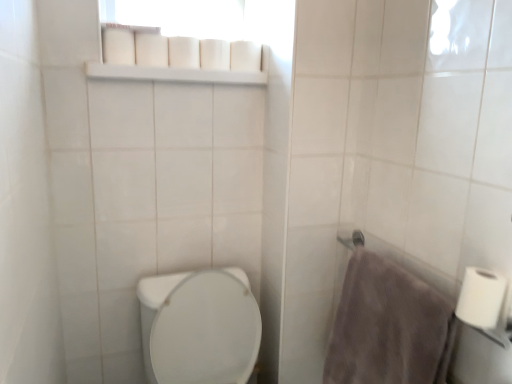
In order to face white matte toilet paper at right, positioned as the 3th toilet paper in top-to-bottom order, should I rotate leftwards or rightwards?

You should rotate right by 27.552 degrees.

Locate an element on the screen. Image resolution: width=512 pixels, height=384 pixels. gray fluffy towel at right is located at coordinates (389, 326).

What do you see at coordinates (389, 326) in the screenshot? This screenshot has height=384, width=512. I see `gray fluffy towel at right` at bounding box center [389, 326].

Measure the distance between white glossy toilet at lower left and camera.

white glossy toilet at lower left and camera are 1.34 meters apart.

The width and height of the screenshot is (512, 384). Find the location of `white matte toilet paper at right, which is the 1th toilet paper in right-to-left order`. white matte toilet paper at right, which is the 1th toilet paper in right-to-left order is located at coordinates (481, 298).

Does point (113, 60) come farther from viewer compared to point (219, 327)?

No, it is in front of (219, 327).

From the image's perspective, is white matte toilet paper at upper center, the 3th toilet paper when ordered from right to left, located above or below white glossy toilet at lower left?

white matte toilet paper at upper center, the 3th toilet paper when ordered from right to left, is above white glossy toilet at lower left.

Consider the image. What's the angular difference between white matte toilet paper at upper center, acting as the second toilet paper starting from the back, and white glossy toilet at lower left's facing directions?

The angle between the facing direction of white matte toilet paper at upper center, acting as the second toilet paper starting from the back, and the facing direction of white glossy toilet at lower left is 0.607 degrees.

Is the surface of white matte toilet paper at upper center, acting as the second toilet paper starting from the back, in direct contact with white glossy toilet at lower left?

No.

In terms of width, does white matte toilet paper at upper center, which appears as the 2th toilet paper when viewed from the right, look wider or thinner when compared to gray fluffy towel at right?

white matte toilet paper at upper center, which appears as the 2th toilet paper when viewed from the right, is thinner than gray fluffy towel at right.

Is gray fluffy towel at right at the back of white matte toilet paper at upper center, the 3th toilet paper when ordered from bottom to top?

Result: white matte toilet paper at upper center, the 3th toilet paper when ordered from bottom to top, is not turned away from gray fluffy towel at right.

What's the angular difference between white matte toilet paper at upper center, which ranks as the first toilet paper in back-to-front order, and gray fluffy towel at right's facing directions?

The facing directions of white matte toilet paper at upper center, which ranks as the first toilet paper in back-to-front order, and gray fluffy towel at right are 88.9 degrees apart.

Considering the positions of objects white matte toilet paper at upper center, which appears as the 2th toilet paper when viewed from the right, and gray fluffy towel at right in the image provided, who is more to the left, white matte toilet paper at upper center, which appears as the 2th toilet paper when viewed from the right, or gray fluffy towel at right?

white matte toilet paper at upper center, which appears as the 2th toilet paper when viewed from the right.

Is gray fluffy towel at right smaller than white matte toilet paper at upper center, acting as the first toilet paper starting from the top?

Actually, gray fluffy towel at right might be larger than white matte toilet paper at upper center, acting as the first toilet paper starting from the top.

How much distance is there between gray fluffy towel at right and white matte toilet paper at upper center, the 3th toilet paper when ordered from bottom to top?

A distance of 35.90 inches exists between gray fluffy towel at right and white matte toilet paper at upper center, the 3th toilet paper when ordered from bottom to top.

Based on the photo, which object is wider, gray fluffy towel at right or white matte toilet paper at upper center, the 3th toilet paper when ordered from bottom to top?

Wider between the two is gray fluffy towel at right.

Is gray fluffy towel at right outside of white matte toilet paper at upper center, acting as the first toilet paper starting from the top?

gray fluffy towel at right is positioned outside white matte toilet paper at upper center, acting as the first toilet paper starting from the top.

Which object is positioned more to the left, white plastic shelf at upper center or white matte toilet paper at upper center, the 2th toilet paper in the top-to-bottom sequence?

white matte toilet paper at upper center, the 2th toilet paper in the top-to-bottom sequence.

Would you say white matte toilet paper at upper center, which is counted as the 2th toilet paper, starting from the bottom, is part of white plastic shelf at upper center's contents?

Definitely not — white matte toilet paper at upper center, which is counted as the 2th toilet paper, starting from the bottom, is not inside white plastic shelf at upper center.

Can you confirm if white plastic shelf at upper center is taller than white matte toilet paper at upper center, which is counted as the 2th toilet paper, starting from the bottom?

In fact, white plastic shelf at upper center may be shorter than white matte toilet paper at upper center, which is counted as the 2th toilet paper, starting from the bottom.

The height and width of the screenshot is (384, 512). Identify the location of the 1st toilet paper above when counting from the white plastic shelf at upper center (from the image's perspective). (118, 46).

Measure the distance between gray fluffy towel at right and white glossy toilet at lower left.

The distance of gray fluffy towel at right from white glossy toilet at lower left is 17.77 inches.

Which object is thinner, gray fluffy towel at right or white glossy toilet at lower left?

gray fluffy towel at right is thinner.

Considering the sizes of gray fluffy towel at right and white glossy toilet at lower left in the image, is gray fluffy towel at right bigger or smaller than white glossy toilet at lower left?

Clearly, gray fluffy towel at right is smaller in size than white glossy toilet at lower left.

Locate an element on the screen. The height and width of the screenshot is (384, 512). toilet located in front of the gray fluffy towel at right is located at coordinates (199, 327).

Considering the sizes of objects white matte toilet paper at right, which is the 1th toilet paper in right-to-left order, and white matte toilet paper at upper center, which is counted as the 2th toilet paper, starting from the bottom, in the image provided, who is thinner, white matte toilet paper at right, which is the 1th toilet paper in right-to-left order, or white matte toilet paper at upper center, which is counted as the 2th toilet paper, starting from the bottom,?

Thinner between the two is white matte toilet paper at upper center, which is counted as the 2th toilet paper, starting from the bottom.

Who is taller, white matte toilet paper at right, which is the 1th toilet paper in right-to-left order, or white matte toilet paper at upper center, positioned as the first toilet paper in left-to-right order?

With more height is white matte toilet paper at right, which is the 1th toilet paper in right-to-left order.

This screenshot has width=512, height=384. Find the location of `the 1st toilet paper behind when counting from the white matte toilet paper at right, positioned as the 3th toilet paper in top-to-bottom order`. the 1st toilet paper behind when counting from the white matte toilet paper at right, positioned as the 3th toilet paper in top-to-bottom order is located at coordinates (118, 46).

Is the surface of white matte toilet paper at right, which is the 1th toilet paper in right-to-left order, in direct contact with white matte toilet paper at upper center, positioned as the first toilet paper in left-to-right order?

No, white matte toilet paper at right, which is the 1th toilet paper in right-to-left order, is not making contact with white matte toilet paper at upper center, positioned as the first toilet paper in left-to-right order.

Between white matte toilet paper at upper center, the 3th toilet paper when ordered from right to left, and white plastic shelf at upper center, which one appears on the left side from the viewer's perspective?

Positioned to the left is white matte toilet paper at upper center, the 3th toilet paper when ordered from right to left.

In the scene shown: Is white matte toilet paper at upper center, the 3th toilet paper when ordered from right to left, aimed at white plastic shelf at upper center?

No, white matte toilet paper at upper center, the 3th toilet paper when ordered from right to left, is not turned towards white plastic shelf at upper center.

From the image's perspective, is white matte toilet paper at upper center, marked as the second toilet paper in a front-to-back arrangement, on top of white plastic shelf at upper center?

Indeed, from the image's perspective, white matte toilet paper at upper center, marked as the second toilet paper in a front-to-back arrangement, is shown above white plastic shelf at upper center.

Locate an element on the screen. This screenshot has width=512, height=384. toilet on the right of white matte toilet paper at upper center, acting as the second toilet paper starting from the back is located at coordinates coord(199,327).

Find the location of `toilet paper that is the 1st object to the left of the gray fluffy towel at right, starting at the anchor`. toilet paper that is the 1st object to the left of the gray fluffy towel at right, starting at the anchor is located at coordinates (245, 56).

From the image, which object appears to be farther from white matte toilet paper at upper center, marked as the 2th toilet paper in a left-to-right arrangement, white plastic shelf at upper center or white matte toilet paper at right, the 1th toilet paper viewed from the front?

white matte toilet paper at right, the 1th toilet paper viewed from the front, is further to white matte toilet paper at upper center, marked as the 2th toilet paper in a left-to-right arrangement.

Based on their spatial positions, is white plastic shelf at upper center or white glossy toilet at lower left closer to white matte toilet paper at right, positioned as the 3th toilet paper in top-to-bottom order?

white glossy toilet at lower left.

Considering their positions, is white matte toilet paper at right, which appears as the 1th toilet paper when ordered from the bottom, positioned further to white matte toilet paper at upper center, acting as the second toilet paper starting from the back, than white matte toilet paper at upper center, the 3th toilet paper when ordered from bottom to top?

white matte toilet paper at right, which appears as the 1th toilet paper when ordered from the bottom, is positioned further to the anchor white matte toilet paper at upper center, acting as the second toilet paper starting from the back.

Which object lies further to the anchor point white matte toilet paper at right, which ranks as the 3th toilet paper in back-to-front order, white glossy toilet at lower left or gray fluffy towel at right?

white glossy toilet at lower left is positioned further to the anchor white matte toilet paper at right, which ranks as the 3th toilet paper in back-to-front order.

Based on their spatial positions, is white matte toilet paper at upper center, acting as the first toilet paper starting from the top, or gray fluffy towel at right further from white plastic shelf at upper center?

gray fluffy towel at right is positioned further to the anchor white plastic shelf at upper center.

From the image, which object appears to be farther from white matte toilet paper at upper center, which appears as the 2th toilet paper when viewed from the right, white matte toilet paper at upper center, the 2th toilet paper in the top-to-bottom sequence, or gray fluffy towel at right?

Based on the image, gray fluffy towel at right appears to be further to white matte toilet paper at upper center, which appears as the 2th toilet paper when viewed from the right.

Estimate the real-world distances between objects in this image. Which object is closer to white matte toilet paper at upper center, which ranks as the first toilet paper in back-to-front order, white matte toilet paper at right, the 1th toilet paper viewed from the front, or gray fluffy towel at right?

gray fluffy towel at right lies closer to white matte toilet paper at upper center, which ranks as the first toilet paper in back-to-front order, than the other object.

Based on their spatial positions, is white glossy toilet at lower left or white matte toilet paper at upper center, the 3th toilet paper when ordered from right to left, closer to gray fluffy towel at right?

Based on the image, white glossy toilet at lower left appears to be nearer to gray fluffy towel at right.

This screenshot has width=512, height=384. In order to click on balustrade between white matte toilet paper at upper center, which is the third toilet paper from front to back, and gray fluffy towel at right in the up-down direction in this screenshot , I will do `click(174, 74)`.

Where is `balustrade between white matte toilet paper at upper center, marked as the second toilet paper in a front-to-back arrangement, and gray fluffy towel at right, in the vertical direction`? balustrade between white matte toilet paper at upper center, marked as the second toilet paper in a front-to-back arrangement, and gray fluffy towel at right, in the vertical direction is located at coordinates (174, 74).

In order to click on bath towel between white matte toilet paper at upper center, the 3th toilet paper when ordered from bottom to top, and white glossy toilet at lower left from top to bottom in this screenshot , I will do `click(389, 326)`.

Where is `toilet paper between white plastic shelf at upper center and white glossy toilet at lower left in the up-down direction`? This screenshot has height=384, width=512. toilet paper between white plastic shelf at upper center and white glossy toilet at lower left in the up-down direction is located at coordinates (481, 298).